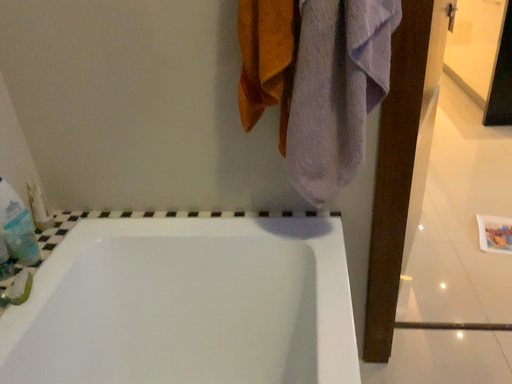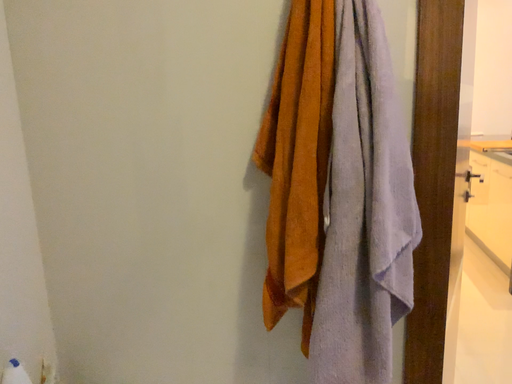
Question: Which way did the camera rotate in the video?

Choices:
 (A) rotated downward
 (B) rotated upward

Answer: (B)